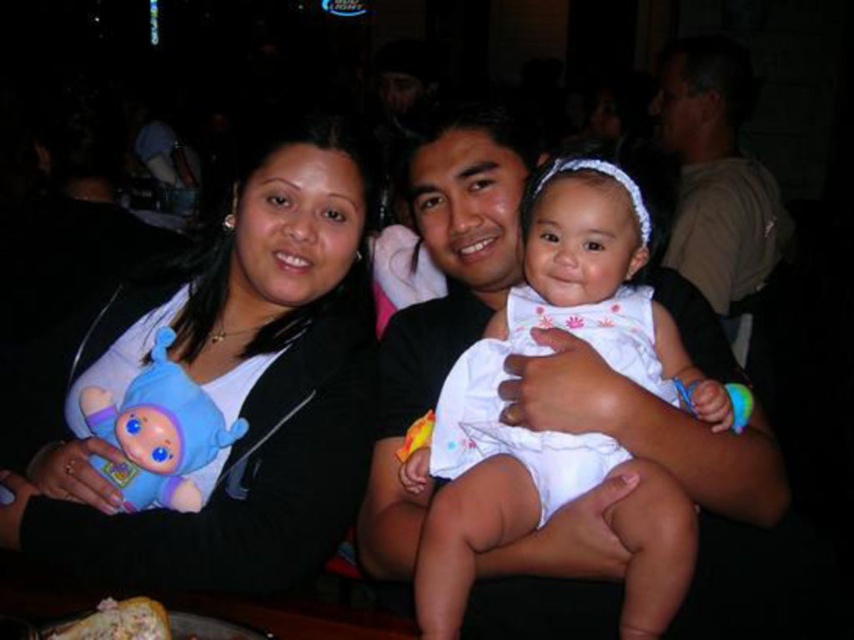
You are a photographer trying to capture the baby in the white cotton dress at center. Based on the coordinates provided, where should you position your camera to ensure the baby is centered in the frame?

To center the baby in the frame, position your camera directly at the coordinates point (544, 353) where the white cotton dress at center is located.

Based on the photo, you are a photographer setting up for a family portrait. You need to ensure that the white cotton dress at center and the blue plush toy at left are both visible in the frame. Considering their sizes, which object should you focus on first to ensure proper framing?

The white cotton dress at center is taller than the blue plush toy at left, so you should focus on framing the white cotton dress at center first to ensure it fits well within the camera frame, and then adjust to include the smaller blue plush toy at left.